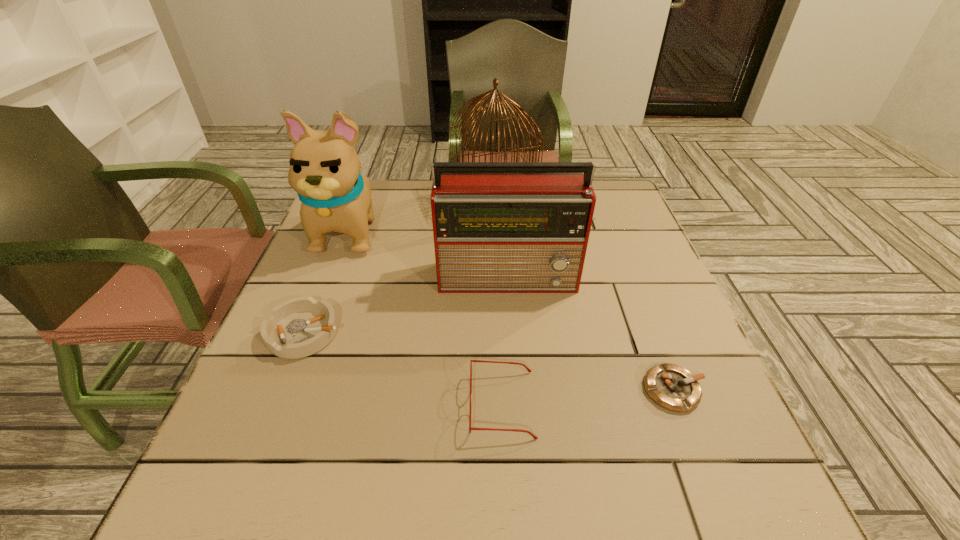
Where is `free space between the puppy and the radio receiver`? Image resolution: width=960 pixels, height=540 pixels. free space between the puppy and the radio receiver is located at coordinates (430, 254).

You are a GUI agent. You are given a task and a screenshot of the screen. Output one action in this format:
    pyautogui.click(x=<x>, y=<y>)
    Task: Click on the vacant space in between the puppy and the birdcage
    This screenshot has height=540, width=960.
    Given the screenshot: What is the action you would take?
    pyautogui.click(x=421, y=215)

Locate an element on the screen. The height and width of the screenshot is (540, 960). free space between the farther ashtray and the third shortest object is located at coordinates (403, 369).

This screenshot has height=540, width=960. In order to click on unoccupied area between the puppy and the birdcage in this screenshot , I will do `click(421, 215)`.

Locate an element on the screen. The image size is (960, 540). free space between the fourth shortest object and the rightmost object is located at coordinates (592, 334).

You are a GUI agent. You are given a task and a screenshot of the screen. Output one action in this format:
    pyautogui.click(x=<x>, y=<y>)
    Task: Click on the object that is the fourth closest to the fourth farthest object
    The width and height of the screenshot is (960, 540).
    Given the screenshot: What is the action you would take?
    pyautogui.click(x=477, y=101)

Locate an element on the screen. The height and width of the screenshot is (540, 960). object that stands as the closest to the radio receiver is located at coordinates (477, 101).

Find the location of a particular element. vacant space that satisfies the following two spatial constraints: 1. on the face of the rightmost object; 2. on the right side of the puppy is located at coordinates (288, 389).

You are a GUI agent. You are given a task and a screenshot of the screen. Output one action in this format:
    pyautogui.click(x=<x>, y=<y>)
    Task: Click on the free space that satisfies the following two spatial constraints: 1. on the front-facing side of the fourth shortest object; 2. on the left side of the shortest object
    This screenshot has width=960, height=540.
    Given the screenshot: What is the action you would take?
    pyautogui.click(x=520, y=389)

Find the location of a particular element. The width and height of the screenshot is (960, 540). free space that satisfies the following two spatial constraints: 1. on the front side of the second shortest object; 2. on the left side of the rightmost object is located at coordinates (282, 389).